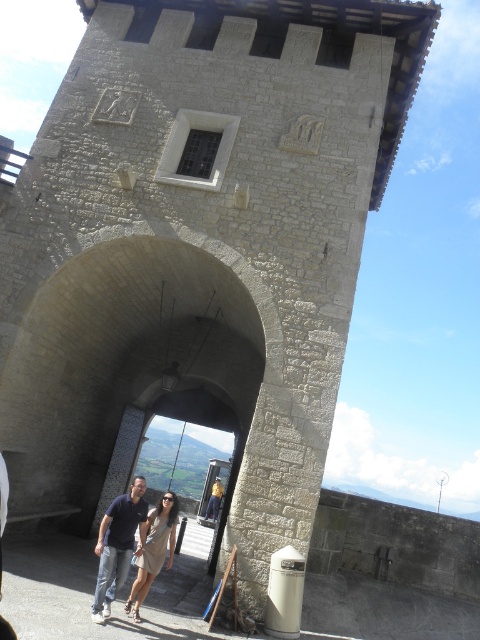
Question: Among these objects, which one is farthest from the camera?

Choices:
 (A) light beige dress at center
 (B) dark blue shirt at center

Answer: (A)

Question: Does dark blue shirt at center have a lesser width compared to light beige dress at center?

Choices:
 (A) no
 (B) yes

Answer: (A)

Question: Is dark blue shirt at center thinner than light beige dress at center?

Choices:
 (A) yes
 (B) no

Answer: (B)

Question: Can you confirm if dark blue shirt at center is positioned above light beige dress at center?

Choices:
 (A) no
 (B) yes

Answer: (A)